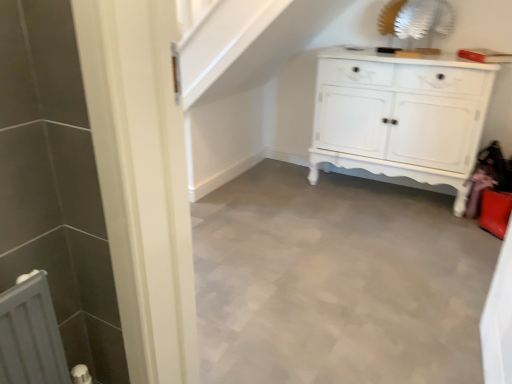
Question: Is white matte radiator at lower left surrounding white painted wood cabinet at center?

Choices:
 (A) no
 (B) yes

Answer: (A)

Question: Is white matte radiator at lower left shorter than white painted wood cabinet at center?

Choices:
 (A) no
 (B) yes

Answer: (B)

Question: Is white matte radiator at lower left smaller than white painted wood cabinet at center?

Choices:
 (A) no
 (B) yes

Answer: (B)

Question: Is there a large distance between white matte radiator at lower left and white painted wood cabinet at center?

Choices:
 (A) yes
 (B) no

Answer: (A)

Question: Is white matte radiator at lower left bigger than white painted wood cabinet at center?

Choices:
 (A) yes
 (B) no

Answer: (B)

Question: Considering the relative positions of white matte radiator at lower left and white painted wood cabinet at center in the image provided, is white matte radiator at lower left behind white painted wood cabinet at center?

Choices:
 (A) yes
 (B) no

Answer: (B)

Question: Could you tell me if smooth gray floor at center is facing white painted wood cabinet at center?

Choices:
 (A) no
 (B) yes

Answer: (A)

Question: Is smooth gray floor at center turned away from white painted wood cabinet at center?

Choices:
 (A) yes
 (B) no

Answer: (B)

Question: From a real-world perspective, is smooth gray floor at center physically above white painted wood cabinet at center?

Choices:
 (A) yes
 (B) no

Answer: (B)

Question: Is smooth gray floor at center closer to the viewer compared to white painted wood cabinet at center?

Choices:
 (A) yes
 (B) no

Answer: (A)

Question: Considering the relative sizes of smooth gray floor at center and white painted wood cabinet at center in the image provided, is smooth gray floor at center thinner than white painted wood cabinet at center?

Choices:
 (A) no
 (B) yes

Answer: (A)

Question: Are smooth gray floor at center and white painted wood cabinet at center beside each other?

Choices:
 (A) no
 (B) yes

Answer: (A)

Question: Is smooth gray floor at center at the back of white painted wood cabinet at center?

Choices:
 (A) no
 (B) yes

Answer: (A)